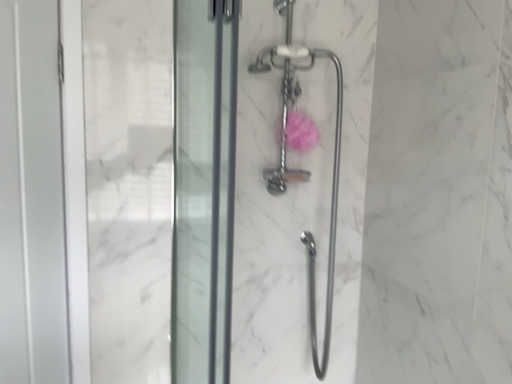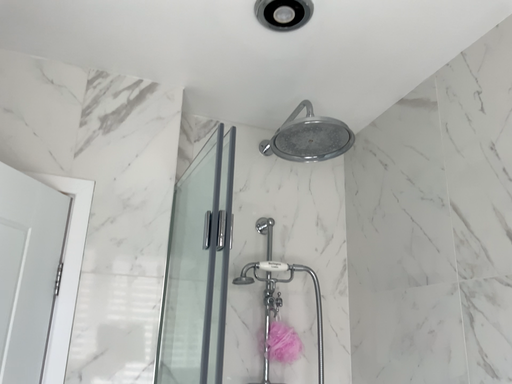
Question: Which way did the camera rotate in the video?

Choices:
 (A) rotated upward
 (B) rotated downward

Answer: (A)